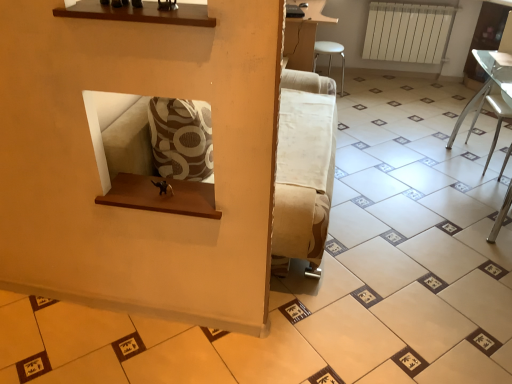
Question: Can you confirm if white fabric armchair at lower right is wider than white matte radiator at upper right?

Choices:
 (A) yes
 (B) no

Answer: (A)

Question: Is white fabric armchair at lower right not close to white matte radiator at upper right?

Choices:
 (A) yes
 (B) no

Answer: (A)

Question: Can you confirm if white fabric armchair at lower right is taller than white matte radiator at upper right?

Choices:
 (A) yes
 (B) no

Answer: (A)

Question: From the image's perspective, does white fabric armchair at lower right appear lower than white matte radiator at upper right?

Choices:
 (A) no
 (B) yes

Answer: (B)

Question: From the image's perspective, does white fabric armchair at lower right appear higher than white matte radiator at upper right?

Choices:
 (A) yes
 (B) no

Answer: (B)

Question: Is point (377, 44) positioned closer to the camera than point (338, 49)?

Choices:
 (A) farther
 (B) closer

Answer: (B)

Question: Is white matte radiator at upper right to the left or to the right of white plastic stool at upper right, positioned as the 2th furniture in front-to-back order, in the image?

Choices:
 (A) right
 (B) left

Answer: (A)

Question: Considering the positions of white matte radiator at upper right and white plastic stool at upper right, which ranks as the 2th furniture in right-to-left order, in the image, is white matte radiator at upper right bigger or smaller than white plastic stool at upper right, which ranks as the 2th furniture in right-to-left order,?

Choices:
 (A) big
 (B) small

Answer: (B)

Question: In terms of height, does white matte radiator at upper right look taller or shorter compared to white plastic stool at upper right, positioned as the 2th furniture in front-to-back order?

Choices:
 (A) short
 (B) tall

Answer: (B)

Question: Looking at the image, does clear glass table at right, marked as the 2th furniture in a top-to-bottom arrangement, seem bigger or smaller compared to white matte radiator at upper right?

Choices:
 (A) small
 (B) big

Answer: (B)

Question: Visually, is clear glass table at right, which is the first furniture in front-to-back order, positioned to the left or to the right of white matte radiator at upper right?

Choices:
 (A) right
 (B) left

Answer: (B)

Question: From a real-world perspective, is clear glass table at right, marked as the 2th furniture in a top-to-bottom arrangement, physically located above or below white matte radiator at upper right?

Choices:
 (A) above
 (B) below

Answer: (B)

Question: Is clear glass table at right, which is the first furniture in front-to-back order, taller or shorter than white matte radiator at upper right?

Choices:
 (A) short
 (B) tall

Answer: (B)

Question: In the image, is clear glass table at right, acting as the 2th furniture starting from the left, on the left side or the right side of white plastic stool at upper right, which ranks as the first furniture in back-to-front order?

Choices:
 (A) right
 (B) left

Answer: (A)

Question: Do you think clear glass table at right, placed as the 2th furniture when sorted from back to front, is within white plastic stool at upper right, which ranks as the 2th furniture in bottom-to-top order, or outside of it?

Choices:
 (A) outside
 (B) inside

Answer: (A)